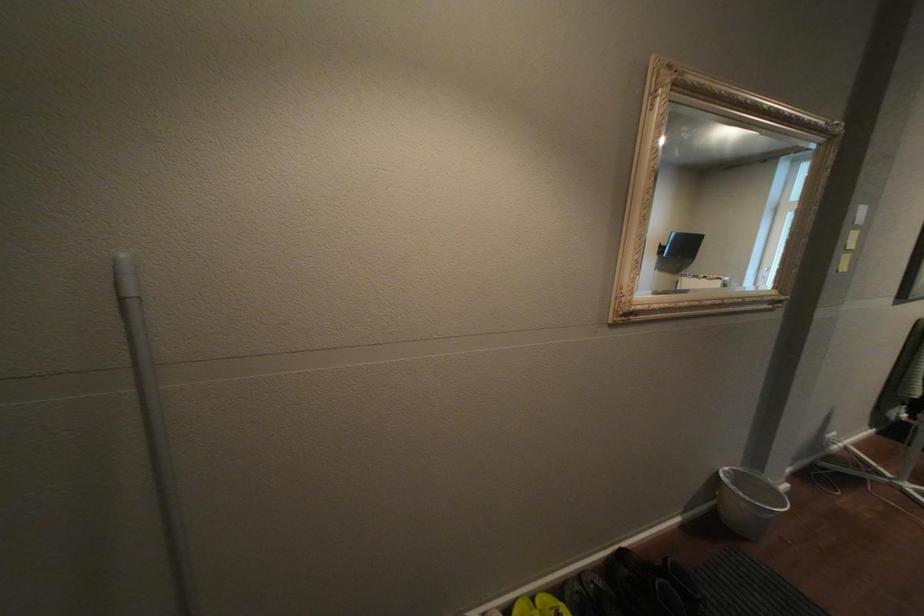
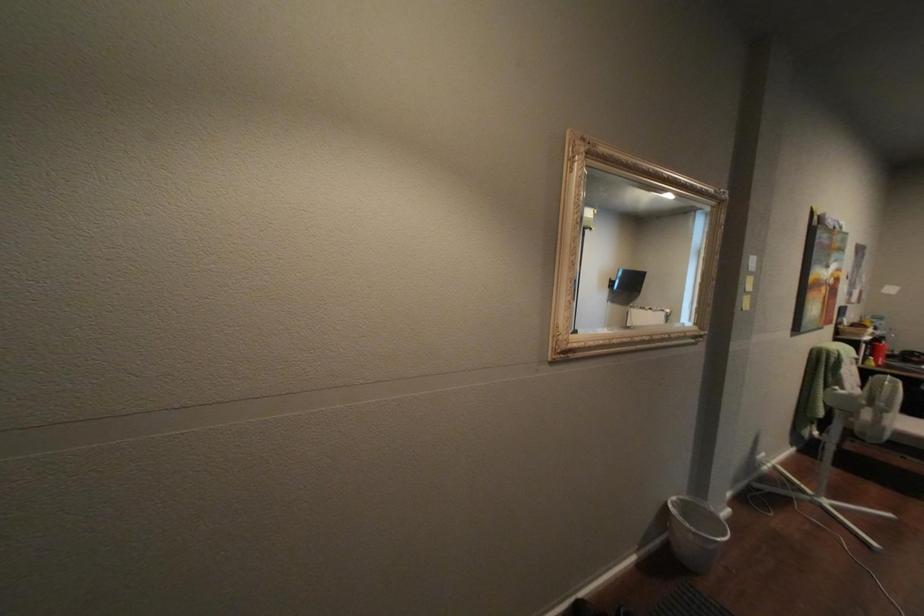
Question: The camera is either moving clockwise (left) or counter-clockwise (right) around the object. The first image is from the beginning of the video and the second image is from the end. Is the camera moving left or right when shooting the video?

Choices:
 (A) Left
 (B) Right

Answer: (A)